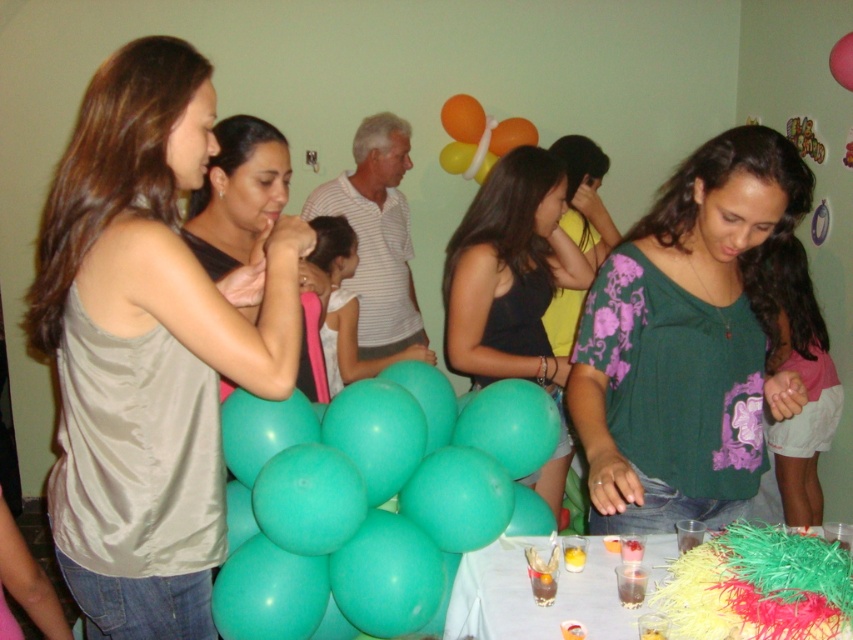
Consider the image. Is the position of white matte dress at center more distant than that of rubber balloon at upper right?

No, white matte dress at center is in front of rubber balloon at upper right.

Measure the distance between white matte dress at center and rubber balloon at upper right.

5.71 feet

Who is more forward, (345, 305) or (845, 67)?

Point (345, 305) is more forward.

Find the location of `white matte dress at center`. white matte dress at center is located at coordinates (346, 308).

Does green floral blouse at center appear under shiny plastic cups at center?

No.

Find the location of a particular element. The height and width of the screenshot is (640, 853). green floral blouse at center is located at coordinates (688, 340).

Does green floral blouse at center appear on the left side of black satin dress at center?

In fact, green floral blouse at center is to the right of black satin dress at center.

Describe the element at coordinates (688, 340) in the screenshot. I see `green floral blouse at center` at that location.

Find the location of `green floral blouse at center`. green floral blouse at center is located at coordinates (688, 340).